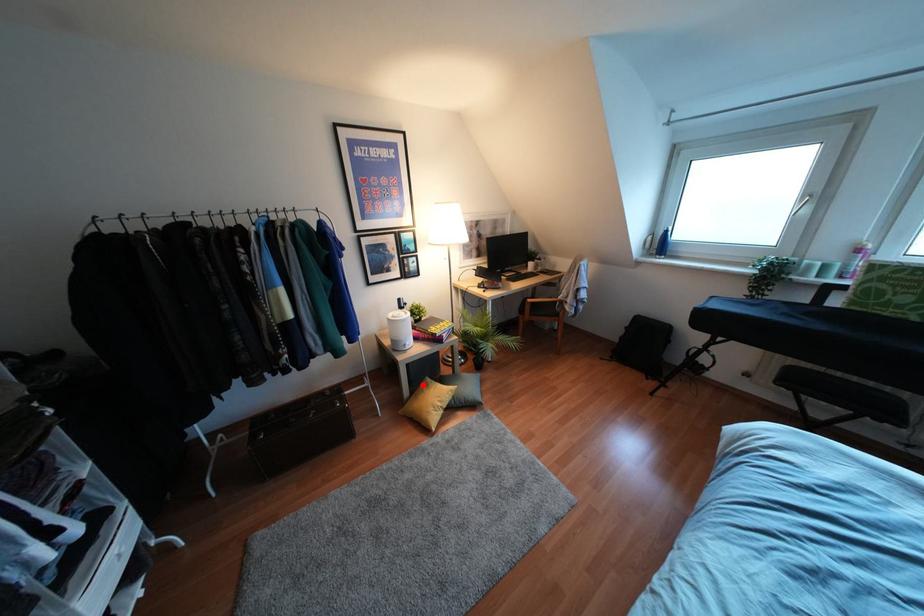
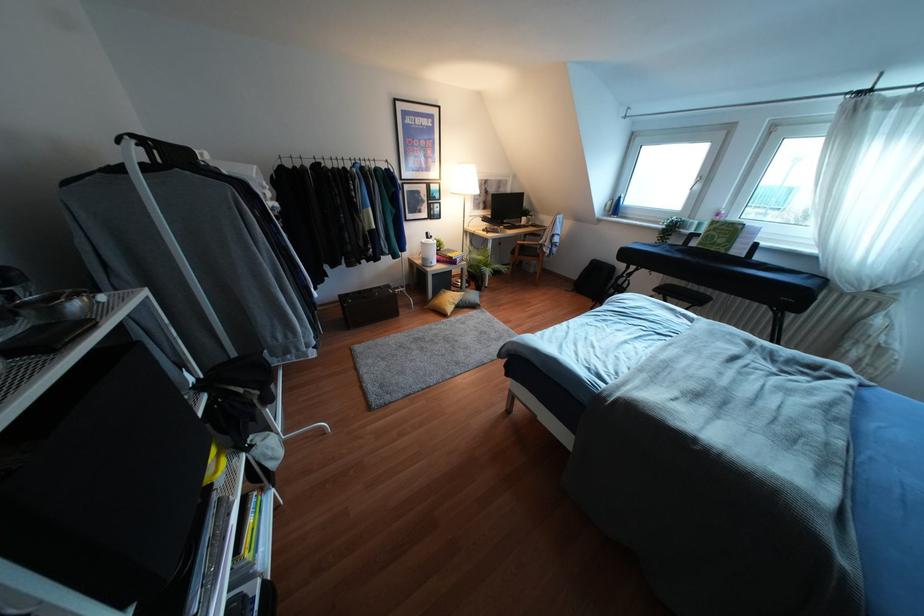
The point at the highlighted location is marked in the first image. Where is the corresponding point in the second image?

(441, 292)